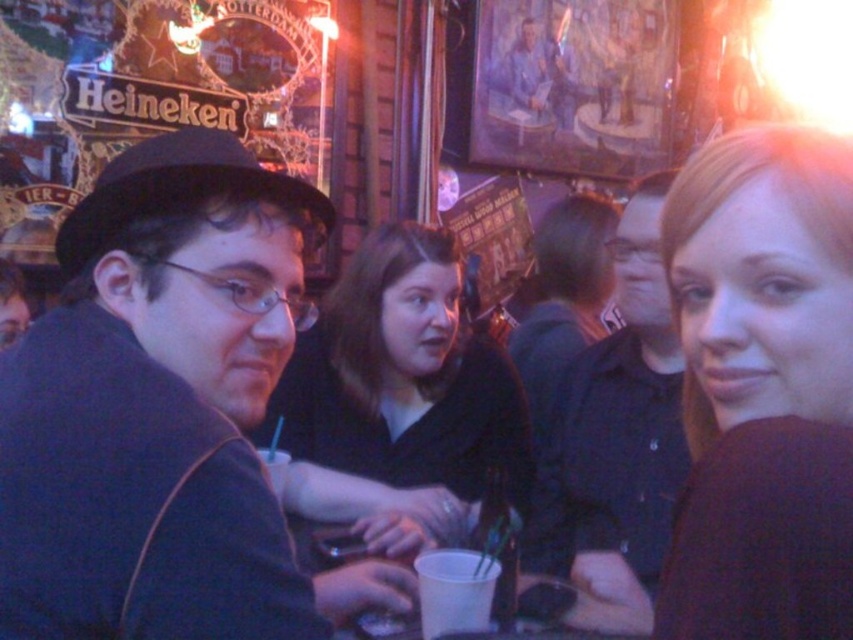
Question: From the image, what is the correct spatial relationship of smooth maroon sweater at right in relation to dark blue shirt at center?

Choices:
 (A) above
 (B) below

Answer: (A)

Question: Is matte black shirt at center bigger than dark blue shirt at center?

Choices:
 (A) yes
 (B) no

Answer: (A)

Question: Estimate the real-world distances between objects in this image. Which object is closer to the smooth maroon sweater at right?

Choices:
 (A) dark gray coat at left
 (B) white paper cup at center
 (C) dark blue shirt at center
 (D) matte black shirt at center

Answer: (B)

Question: Which point appears farthest from the camera in this image?

Choices:
 (A) (189, 307)
 (B) (486, 611)
 (C) (651, 304)
 (D) (680, 580)

Answer: (C)

Question: Which object is the farthest from the dark blue shirt at center?

Choices:
 (A) matte black shirt at center
 (B) white paper cup at center
 (C) smooth maroon sweater at right

Answer: (C)

Question: Can you confirm if dark gray coat at left is positioned to the right of matte black shirt at center?

Choices:
 (A) yes
 (B) no

Answer: (B)